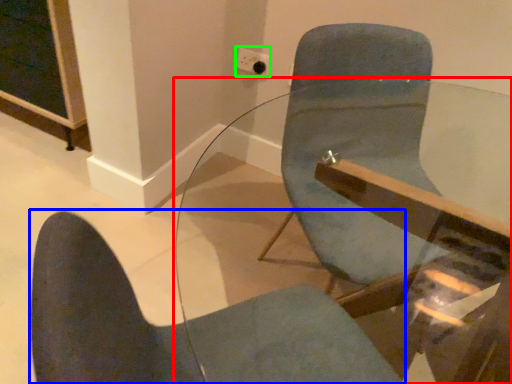
Question: Which object is positioned closest to table (highlighted by a red box)? Select from chair (highlighted by a blue box) and electric outlet (highlighted by a green box).

Choices:
 (A) chair
 (B) electric outlet

Answer: (A)